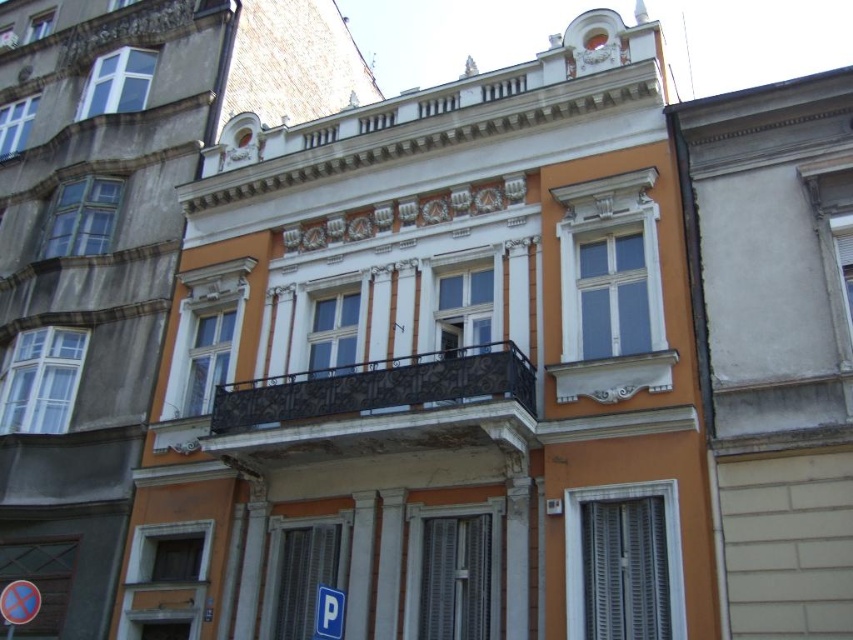
Question: Which point is closer to the camera?

Choices:
 (A) black wrought iron balcony at center
 (B) blue plastic parking sign at lower center

Answer: (B)

Question: Which of the following is the farthest from the observer?

Choices:
 (A) (x=326, y=627)
 (B) (x=517, y=403)

Answer: (B)

Question: Does black wrought iron balcony at center have a smaller size compared to blue plastic parking sign at lower center?

Choices:
 (A) no
 (B) yes

Answer: (A)

Question: Can you confirm if black wrought iron balcony at center is positioned above blue plastic parking sign at lower center?

Choices:
 (A) yes
 (B) no

Answer: (A)

Question: Which object appears farthest from the camera in this image?

Choices:
 (A) blue plastic parking sign at lower center
 (B) black wrought iron balcony at center

Answer: (B)

Question: Does black wrought iron balcony at center have a larger size compared to blue plastic parking sign at lower center?

Choices:
 (A) no
 (B) yes

Answer: (B)